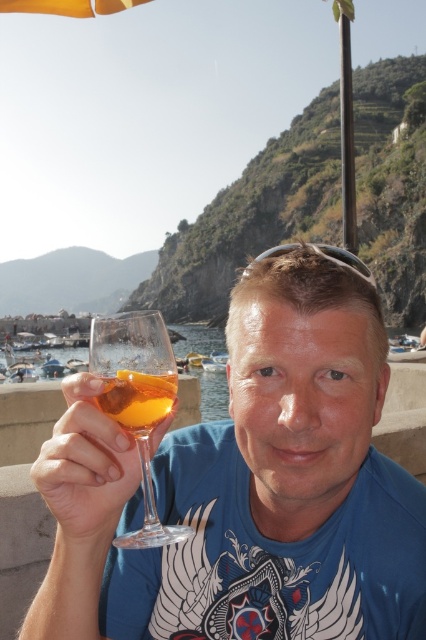
Question: Can you confirm if clear glass wine glass at center is positioned to the right of transparent glass at center?

Choices:
 (A) yes
 (B) no

Answer: (A)

Question: Which is farther from the translucent amber liquid at center?

Choices:
 (A) transparent glass at center
 (B) clear glass wine glass at center

Answer: (B)

Question: Which point is farther from the camera taking this photo?

Choices:
 (A) (57, 577)
 (B) (154, 412)
 (C) (132, 406)

Answer: (B)

Question: Is the position of transparent glass at center less distant than that of translucent amber liquid at center?

Choices:
 (A) yes
 (B) no

Answer: (A)

Question: Can you confirm if clear glass wine glass at center is positioned to the left of transparent glass at center?

Choices:
 (A) yes
 (B) no

Answer: (B)

Question: Which of the following is the closest to the observer?

Choices:
 (A) (121, 371)
 (B) (360, 625)
 (C) (126, 332)

Answer: (B)